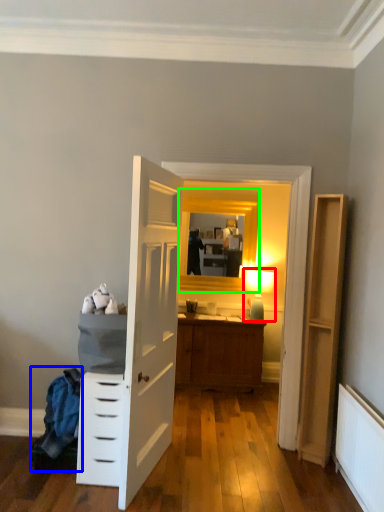
Question: Considering the real-world distances, which object is closest to light fixture (highlighted by a red box)? laundry (highlighted by a blue box) or window (highlighted by a green box).

Choices:
 (A) laundry
 (B) window

Answer: (B)